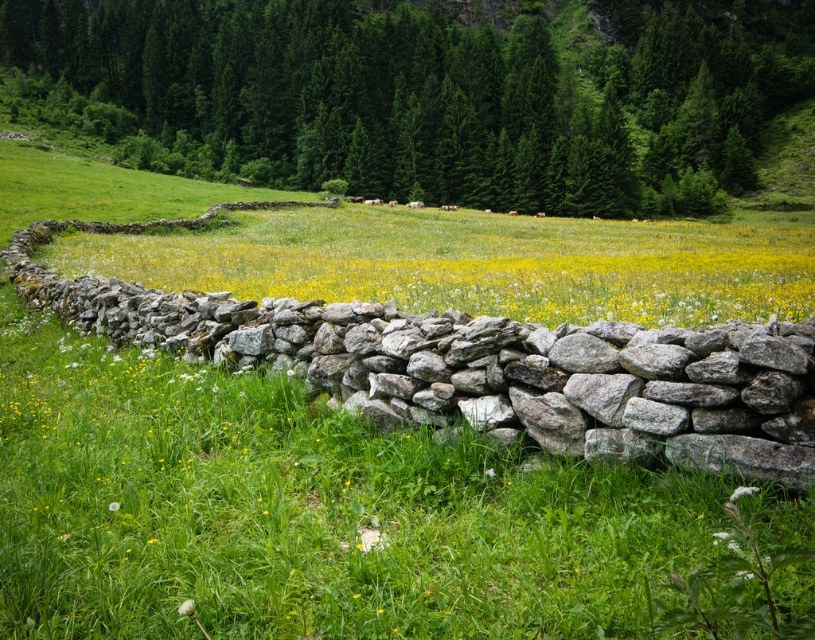
The image size is (815, 640). What do you see at coordinates (476, 266) in the screenshot? I see `yellow grass at center` at bounding box center [476, 266].

Between yellow grass at center and white fluffy dandelion at lower left, which one has more height?

yellow grass at center

Is point (650, 230) more distant than point (109, 508)?

That is True.

Identify the location of yellow grass at center. (476, 266).

Does point (751, 488) come in front of point (117, 508)?

Yes, it is.

You are a GUI agent. You are given a task and a screenshot of the screen. Output one action in this format:
    pyautogui.click(x=<x>, y=<y>)
    Task: Click on the white fluffy flower at lower right
    
    Given the screenshot: What is the action you would take?
    pyautogui.click(x=742, y=492)

Identify the location of white fluffy flower at lower right. This screenshot has width=815, height=640. (742, 492).

Does yellow grass at center appear on the right side of white fluffy flower at lower right?

Indeed, yellow grass at center is positioned on the right side of white fluffy flower at lower right.

Is point (474, 244) more distant than point (728, 499)?

That is True.

Who is more forward, (807, 253) or (742, 488)?

Point (742, 488) is more forward.

Locate an element on the screen. yellow grass at center is located at coordinates (476, 266).